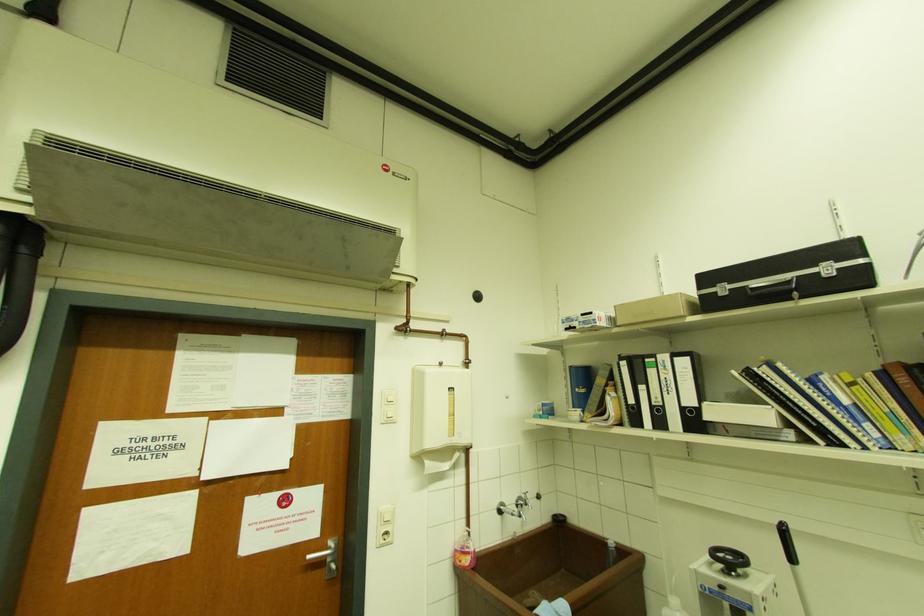
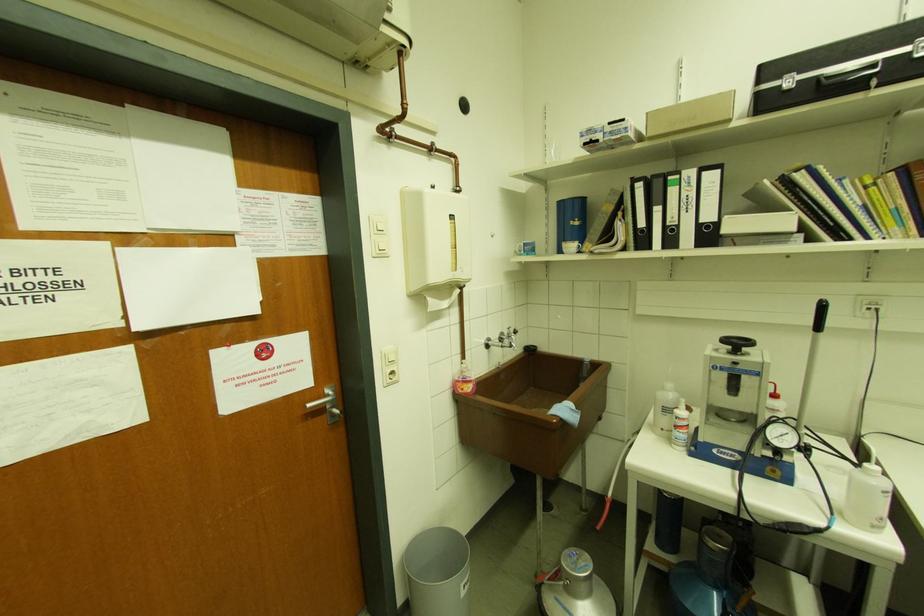
In the second image, find the point that corresponds to (517,503) in the first image.

(501, 339)